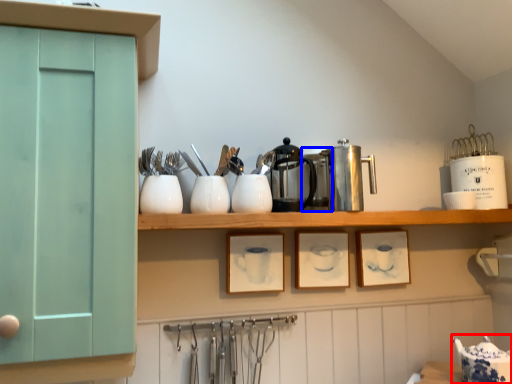
Question: Which of the following is the closest to the observer, tableware (highlighted by a red box) or appliance (highlighted by a blue box)?

Choices:
 (A) tableware
 (B) appliance

Answer: (A)